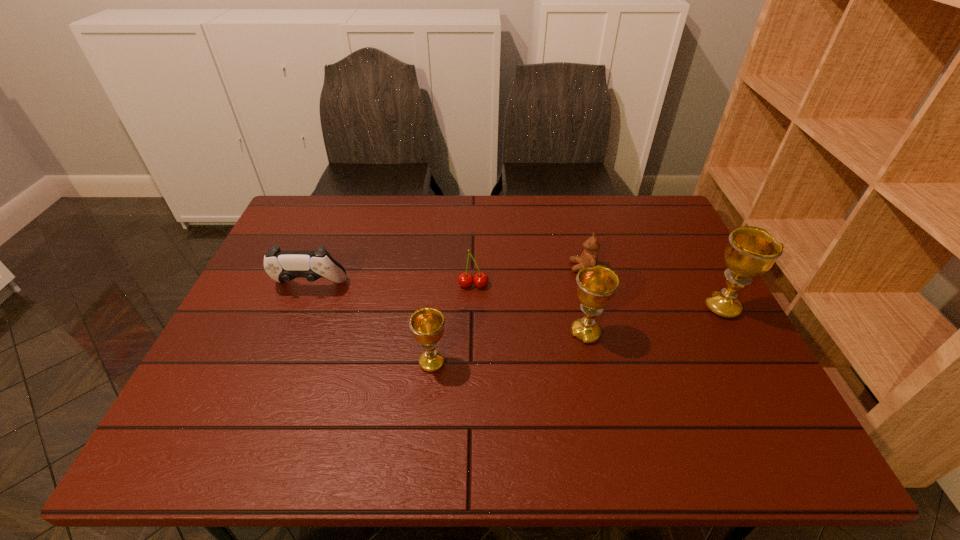
Please point out where to position a new chalice on the left to maintain spacing. Please provide its 2D coordinates. Your answer should be formatted as a tuple, i.e. [(x, y)], where the tuple contains the x and y coordinates of a point satisfying the conditions above.

[(258, 395)]